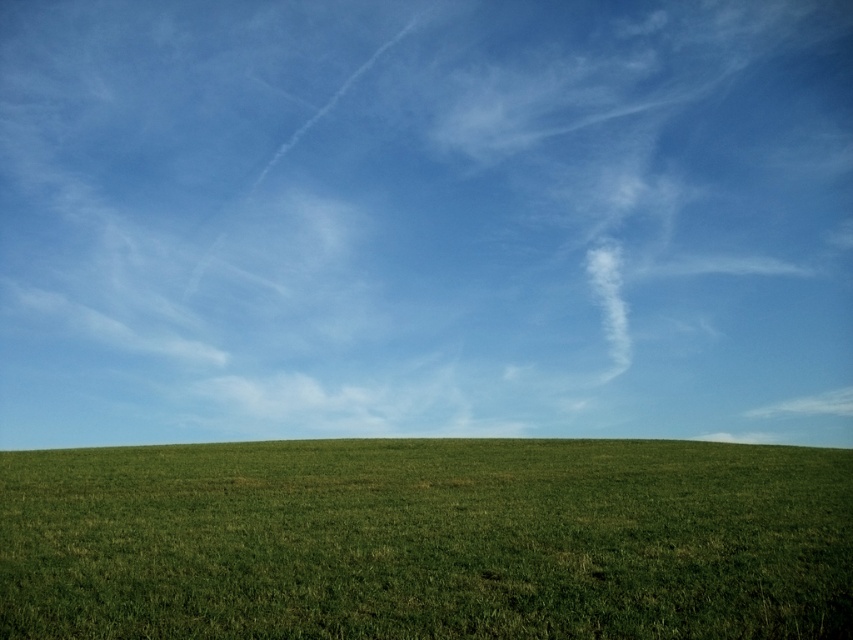
Who is positioned more to the left, white cotton cloud at upper center or green grassy field at lower center?

Positioned to the left is green grassy field at lower center.

Which is below, white cotton cloud at upper center or green grassy field at lower center?

green grassy field at lower center is lower down.

Which is behind, point (225, 189) or point (805, 515)?

The point (225, 189) is behind.

At what (x,y) coordinates should I click in order to perform the action: click on white cotton cloud at upper center. Please return your answer as a coordinate pair (x, y). The width and height of the screenshot is (853, 640). Looking at the image, I should click on (425, 220).